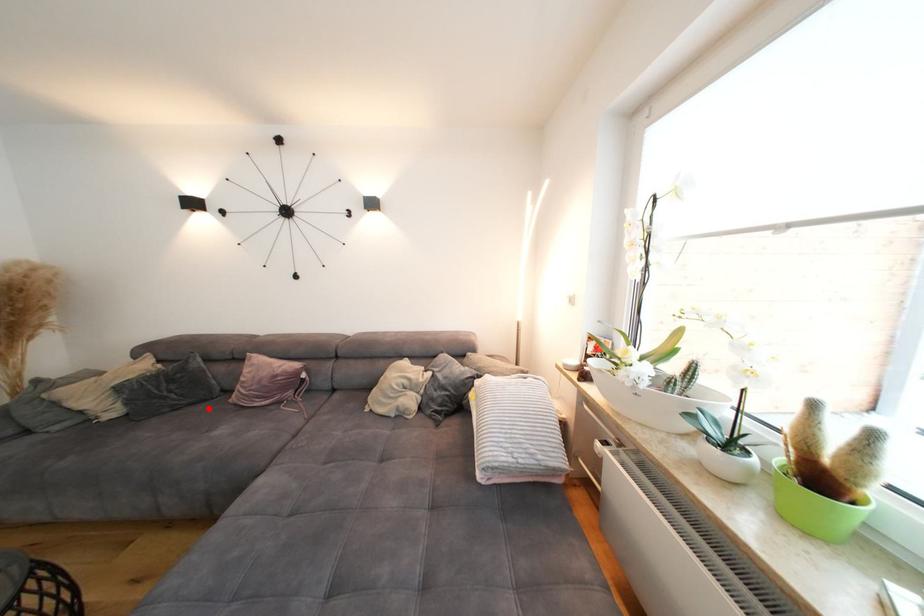
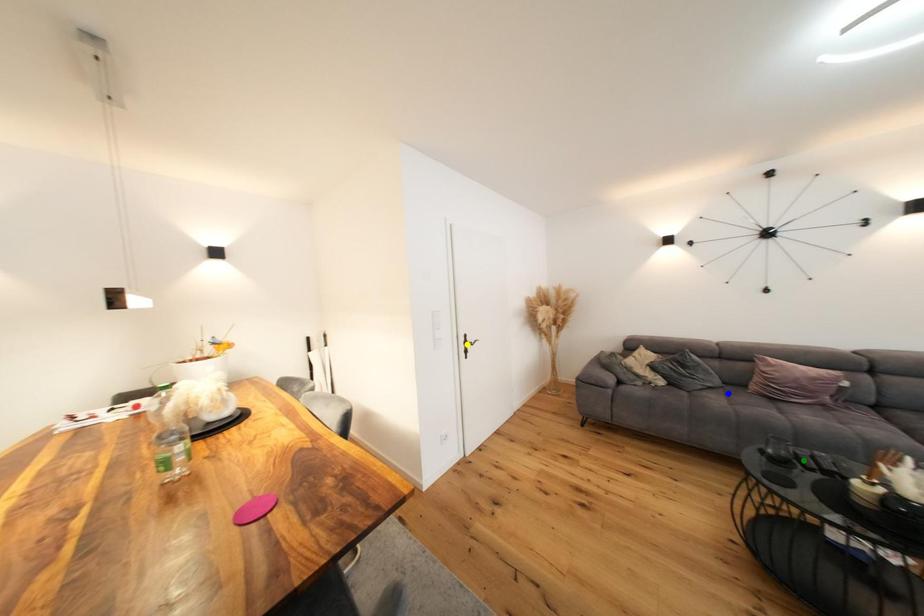
Question: I am providing you with two images of the same scene from different viewpoints. A red point is marked on the first image. You are given multiple points on the second image. In image 2, which mark is for the same physical point as the one in image 1?

Choices:
 (A) yellow point
 (B) green point
 (C) blue point

Answer: (C)